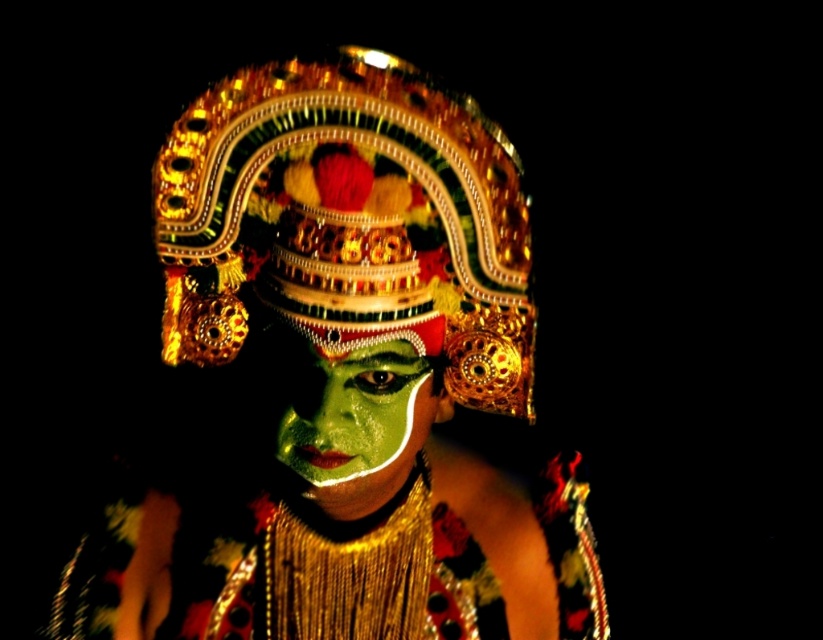
Question: Can you confirm if green matte face paint at center is positioned to the left of green matte face at center?

Choices:
 (A) yes
 (B) no

Answer: (A)

Question: Considering the relative positions of green matte face paint at center and green matte face at center in the image provided, where is green matte face paint at center located with respect to green matte face at center?

Choices:
 (A) right
 (B) left

Answer: (B)

Question: Among these points, which one is farthest from the camera?

Choices:
 (A) (436, 227)
 (B) (333, 384)

Answer: (B)

Question: Can you confirm if green matte face paint at center is wider than green matte face at center?

Choices:
 (A) no
 (B) yes

Answer: (B)